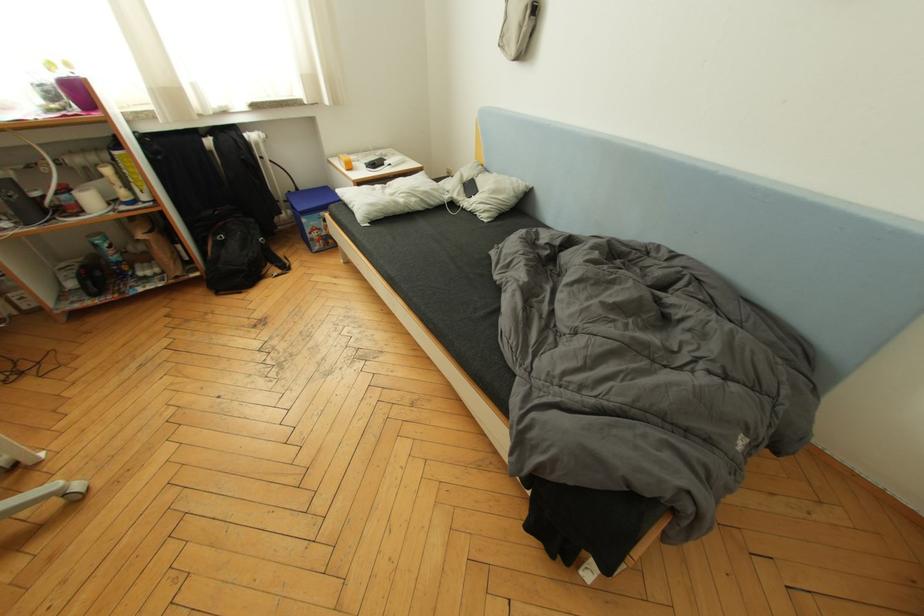
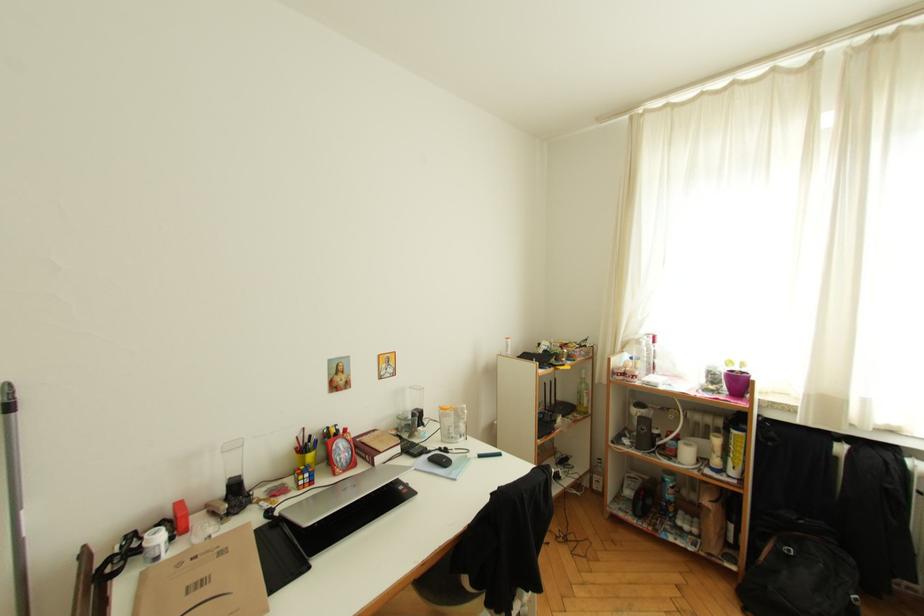
Question: The camera is either moving clockwise (left) or counter-clockwise (right) around the object. The first image is from the beginning of the video and the second image is from the end. Is the camera moving left or right when shooting the video?

Choices:
 (A) Left
 (B) Right

Answer: (B)